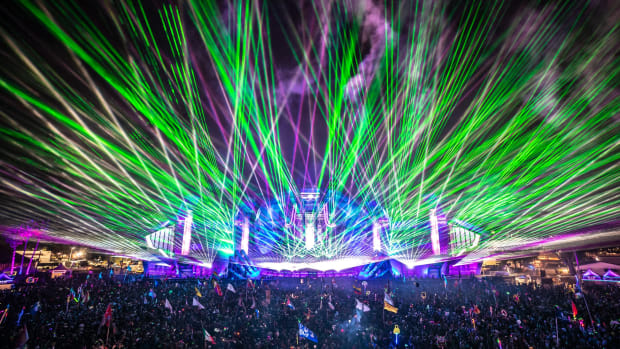
The width and height of the screenshot is (620, 349). In order to click on stage in this screenshot , I will do `click(298, 284)`, `click(351, 283)`, `click(428, 279)`.